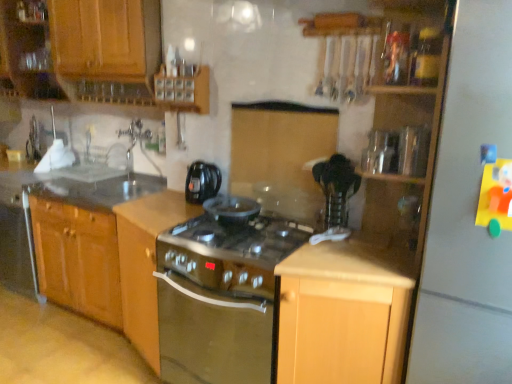
The width and height of the screenshot is (512, 384). What are the coordinates of `vacant region above satin wood stove at center, which ranks as the 3th cabinetry in right-to-left order (from a real-world perspective)` in the screenshot? It's located at (156, 205).